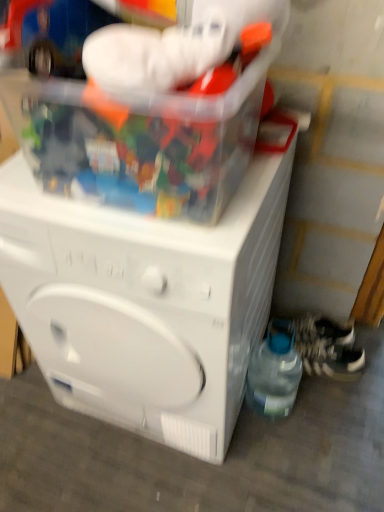
Question: Is white textured shoe at lower right, which appears as the second shoe when viewed from the top, facing towards white textured shoe at lower right, marked as the 2th shoe in a bottom-to-top arrangement?

Choices:
 (A) yes
 (B) no

Answer: (B)

Question: Is the surface of white textured shoe at lower right, arranged as the first shoe when ordered from the bottom, in direct contact with white textured shoe at lower right, which ranks as the 1th shoe in top-to-bottom order?

Choices:
 (A) no
 (B) yes

Answer: (B)

Question: From a real-world perspective, is white textured shoe at lower right, which appears as the second shoe when viewed from the top, physically above white textured shoe at lower right, which ranks as the 1th shoe in top-to-bottom order?

Choices:
 (A) yes
 (B) no

Answer: (B)

Question: Is white textured shoe at lower right, marked as the 2th shoe in a bottom-to-top arrangement, at the back of white textured shoe at lower right, which appears as the second shoe when viewed from the top?

Choices:
 (A) no
 (B) yes

Answer: (A)

Question: Is white textured shoe at lower right, which appears as the second shoe when viewed from the top, positioned beyond the bounds of white textured shoe at lower right, which ranks as the 1th shoe in top-to-bottom order?

Choices:
 (A) no
 (B) yes

Answer: (B)

Question: Is white textured shoe at lower right, arranged as the first shoe when ordered from the bottom, taller or shorter than white textured shoe at lower right, marked as the 2th shoe in a bottom-to-top arrangement?

Choices:
 (A) tall
 (B) short

Answer: (A)

Question: Is white textured shoe at lower right, arranged as the first shoe when ordered from the bottom, in front of or behind white textured shoe at lower right, marked as the 2th shoe in a bottom-to-top arrangement, in the image?

Choices:
 (A) behind
 (B) front

Answer: (B)

Question: From a real-world perspective, is white textured shoe at lower right, which appears as the second shoe when viewed from the top, physically located above or below white textured shoe at lower right, which ranks as the 1th shoe in top-to-bottom order?

Choices:
 (A) above
 (B) below

Answer: (B)

Question: Considering the positions of white textured shoe at lower right, which appears as the second shoe when viewed from the top, and white textured shoe at lower right, marked as the 2th shoe in a bottom-to-top arrangement, in the image, is white textured shoe at lower right, which appears as the second shoe when viewed from the top, bigger or smaller than white textured shoe at lower right, marked as the 2th shoe in a bottom-to-top arrangement,?

Choices:
 (A) big
 (B) small

Answer: (A)

Question: Would you say white textured shoe at lower right, marked as the 2th shoe in a bottom-to-top arrangement, is to the left or to the right of white textured shoe at lower right, which appears as the second shoe when viewed from the top, in the picture?

Choices:
 (A) left
 (B) right

Answer: (B)

Question: In the image, is white textured shoe at lower right, which ranks as the 1th shoe in top-to-bottom order, positioned in front of or behind white textured shoe at lower right, which appears as the second shoe when viewed from the top?

Choices:
 (A) behind
 (B) front

Answer: (A)

Question: Is white textured shoe at lower right, which ranks as the 1th shoe in top-to-bottom order, spatially inside white textured shoe at lower right, which appears as the second shoe when viewed from the top, or outside of it?

Choices:
 (A) inside
 (B) outside

Answer: (B)

Question: Considering the positions of point (339, 334) and point (324, 344), is point (339, 334) closer or farther from the camera than point (324, 344)?

Choices:
 (A) farther
 (B) closer

Answer: (A)

Question: Considering the relative positions of white plastic washing machine at center and white textured shoe at lower right, which ranks as the 1th shoe in top-to-bottom order, in the image provided, is white plastic washing machine at center to the left or to the right of white textured shoe at lower right, which ranks as the 1th shoe in top-to-bottom order,?

Choices:
 (A) left
 (B) right

Answer: (A)

Question: In terms of height, does white plastic washing machine at center look taller or shorter compared to white textured shoe at lower right, which ranks as the 1th shoe in top-to-bottom order?

Choices:
 (A) short
 (B) tall

Answer: (B)